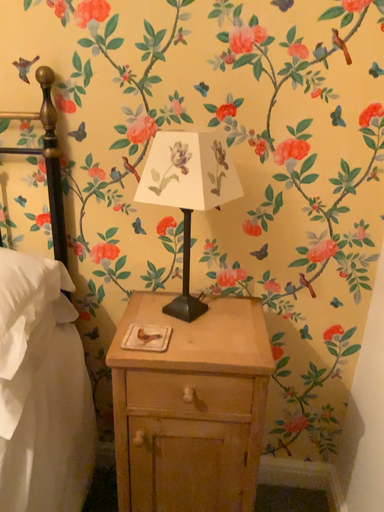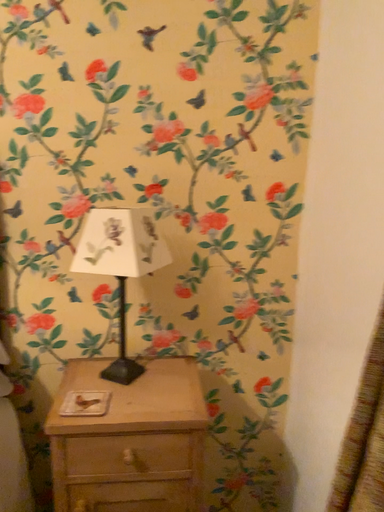
Question: Which way did the camera rotate in the video?

Choices:
 (A) rotated left
 (B) rotated right

Answer: (B)